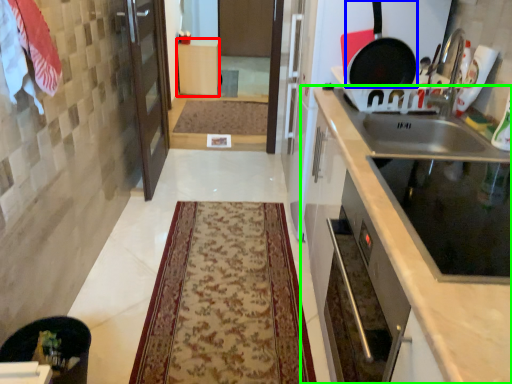
Question: Based on their relative distances, which object is farther from cabinetry (highlighted by a red box)? Choose from frying pan (highlighted by a blue box) and cabinetry (highlighted by a green box).

Choices:
 (A) frying pan
 (B) cabinetry

Answer: (B)